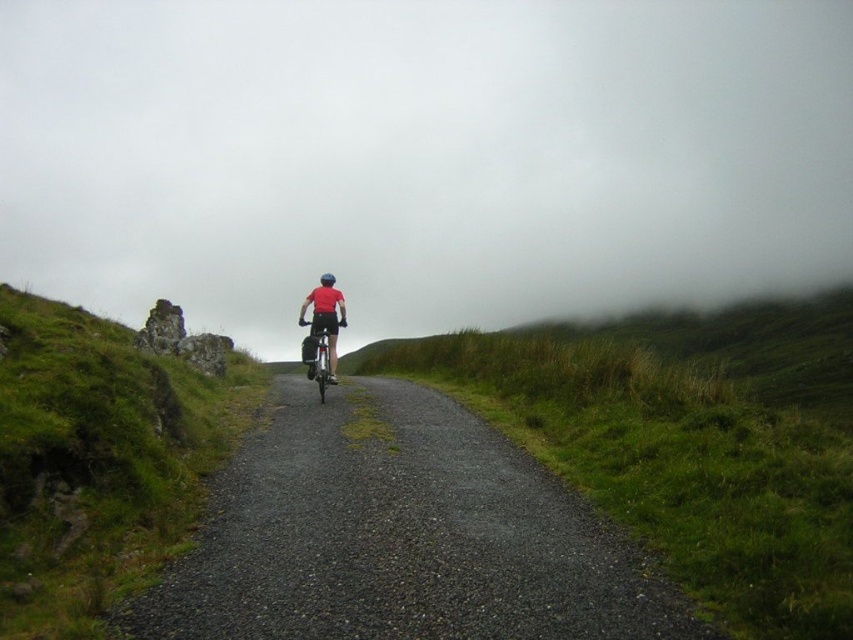
You are a cyclist approaching the gravel road at center and the green grassy hillside at left. Which object is closer to the ground?

The gravel road at center is positioned under the green grassy hillside at left, so the gravel road at center is closer to the ground.